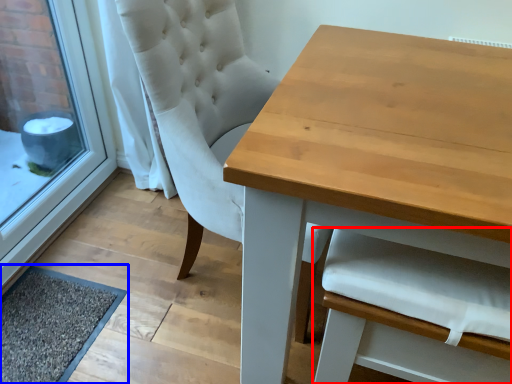
Question: Which object is further to the camera taking this photo, armchair (highlighted by a red box) or doormat (highlighted by a blue box)?

Choices:
 (A) armchair
 (B) doormat

Answer: (B)